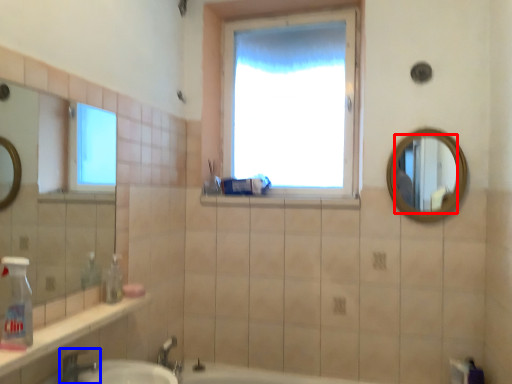
Question: Among these objects, which one is nearest to the camera, mirror (highlighted by a red box) or tap (highlighted by a blue box)?

Choices:
 (A) mirror
 (B) tap

Answer: (B)